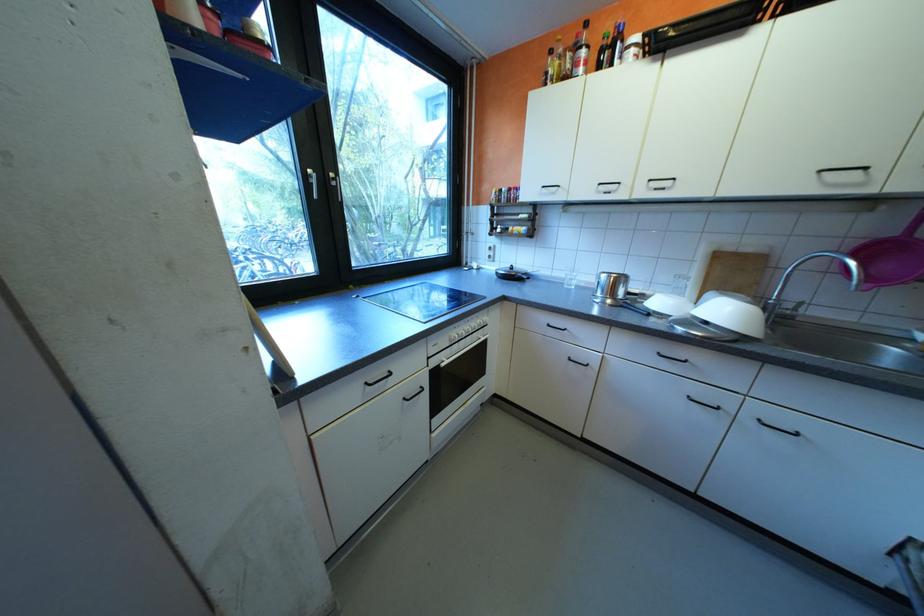
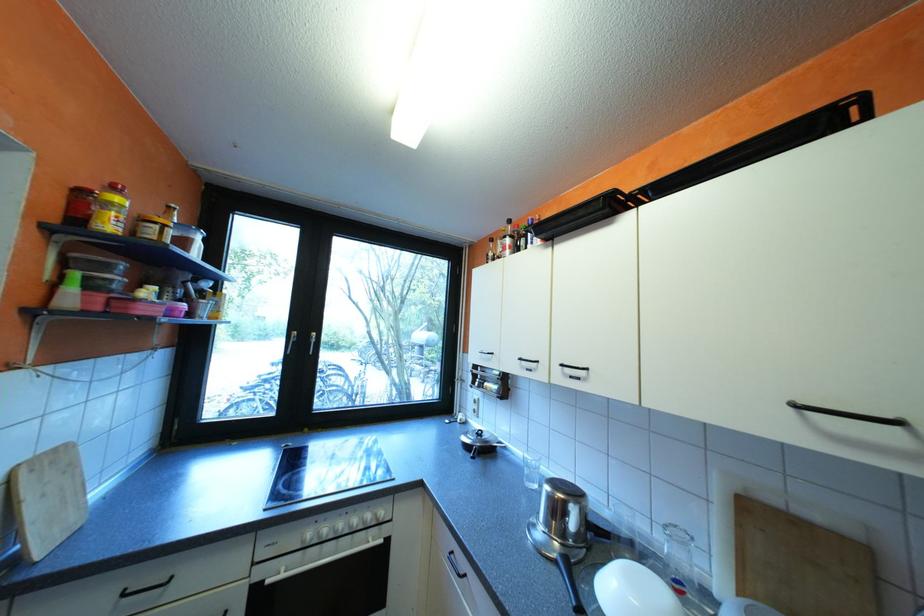
Locate, in the second image, the point that corresponds to (661,188) in the first image.

(576, 373)